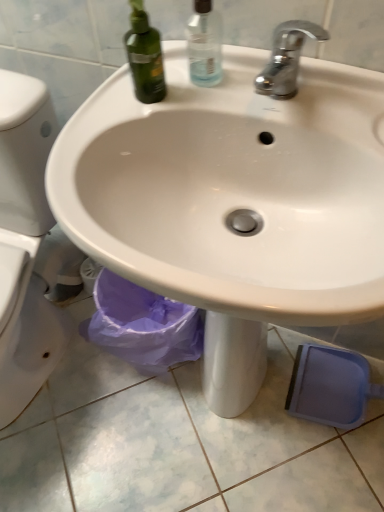
Where is `chrome metallic faucet at upper center`? chrome metallic faucet at upper center is located at coordinates (286, 58).

Describe the element at coordinates (205, 44) in the screenshot. I see `transparent plastic spray bottle at upper center` at that location.

At what (x,y) coordinates should I click in order to perform the action: click on white glossy sink at center. Please return your answer as a coordinate pair (x, y). The image size is (384, 512). Looking at the image, I should click on (x=233, y=202).

From a real-world perspective, is transparent plastic spray bottle at upper center located higher than chrome metallic faucet at upper center?

Yes, from a real-world perspective, transparent plastic spray bottle at upper center is above chrome metallic faucet at upper center.

In terms of height, does transparent plastic spray bottle at upper center look taller or shorter compared to chrome metallic faucet at upper center?

In the image, transparent plastic spray bottle at upper center appears to be taller than chrome metallic faucet at upper center.

Is transparent plastic spray bottle at upper center to the left of chrome metallic faucet at upper center from the viewer's perspective?

Indeed, transparent plastic spray bottle at upper center is positioned on the left side of chrome metallic faucet at upper center.

Is transparent plastic spray bottle at upper center spatially inside chrome metallic faucet at upper center, or outside of it?

transparent plastic spray bottle at upper center cannot be found inside chrome metallic faucet at upper center.

From a real-world perspective, between transparent plastic spray bottle at upper center and white glossy sink at center, who is vertically higher?

transparent plastic spray bottle at upper center.

Which of these two, transparent plastic spray bottle at upper center or white glossy sink at center, stands taller?

Standing taller between the two is white glossy sink at center.

Would you say transparent plastic spray bottle at upper center is inside or outside white glossy sink at center?

transparent plastic spray bottle at upper center is located beyond the bounds of white glossy sink at center.

Considering the relative sizes of transparent plastic spray bottle at upper center and white glossy sink at center in the image provided, is transparent plastic spray bottle at upper center bigger than white glossy sink at center?

Incorrect, transparent plastic spray bottle at upper center is not larger than white glossy sink at center.

Is chrome metallic faucet at upper center placed right next to transparent plastic spray bottle at upper center?

No, chrome metallic faucet at upper center is not next to transparent plastic spray bottle at upper center.

From a real-world perspective, is chrome metallic faucet at upper center under transparent plastic spray bottle at upper center?

Indeed, from a real-world perspective, chrome metallic faucet at upper center is positioned beneath transparent plastic spray bottle at upper center.

How far apart are chrome metallic faucet at upper center and transparent plastic spray bottle at upper center?

The distance of chrome metallic faucet at upper center from transparent plastic spray bottle at upper center is 4.63 inches.

Is white glossy sink at center in contact with transparent plastic spray bottle at upper center?

white glossy sink at center and transparent plastic spray bottle at upper center are not in contact.

From the picture: Is white glossy sink at center turned away from transparent plastic spray bottle at upper center?

white glossy sink at center does not have its back to transparent plastic spray bottle at upper center.

This screenshot has height=512, width=384. What are the coordinates of `sink lying in front of the transparent plastic spray bottle at upper center` in the screenshot? It's located at (233, 202).

Considering the sizes of objects white glossy sink at center and transparent plastic spray bottle at upper center in the image provided, who is smaller, white glossy sink at center or transparent plastic spray bottle at upper center?

Smaller between the two is transparent plastic spray bottle at upper center.

Does white glossy sink at center have a lesser height compared to chrome metallic faucet at upper center?

No.

Does white glossy sink at center touch chrome metallic faucet at upper center?

No, white glossy sink at center is not making contact with chrome metallic faucet at upper center.

Is white glossy sink at center outside of chrome metallic faucet at upper center?

Indeed, white glossy sink at center is completely outside chrome metallic faucet at upper center.

Does white glossy sink at center lie in front of chrome metallic faucet at upper center?

That is True.

From the picture: Which is nearer, (x=310, y=25) or (x=195, y=109)?

Clearly, point (x=310, y=25) is closer to the camera than point (x=195, y=109).

Is white glossy sink at center inside chrome metallic faucet at upper center?

No.

Which of these two, chrome metallic faucet at upper center or white glossy sink at center, is thinner?

With smaller width is chrome metallic faucet at upper center.

Find the location of a particular element. cleaning product above the chrome metallic faucet at upper center (from the image's perspective) is located at coordinates pos(205,44).

This screenshot has width=384, height=512. I want to click on cleaning product positioned vertically above the white glossy sink at center (from a real-world perspective), so click(205, 44).

Considering their positions, is transparent plastic spray bottle at upper center positioned closer to chrome metallic faucet at upper center than white glossy sink at center?

transparent plastic spray bottle at upper center is positioned closer to the anchor chrome metallic faucet at upper center.

Based on their spatial positions, is chrome metallic faucet at upper center or white glossy sink at center closer to transparent plastic spray bottle at upper center?

chrome metallic faucet at upper center is positioned closer to the anchor transparent plastic spray bottle at upper center.

Considering their positions, is white glossy sink at center positioned further to transparent plastic spray bottle at upper center than chrome metallic faucet at upper center?

Based on the image, white glossy sink at center appears to be further to transparent plastic spray bottle at upper center.

Based on the photo, from the image, which object appears to be farther from chrome metallic faucet at upper center, white glossy sink at center or transparent plastic spray bottle at upper center?

The object further to chrome metallic faucet at upper center is white glossy sink at center.

From the image, which object appears to be nearer to white glossy sink at center, transparent plastic spray bottle at upper center or chrome metallic faucet at upper center?

chrome metallic faucet at upper center is closer to white glossy sink at center.

Considering their positions, is chrome metallic faucet at upper center positioned further to white glossy sink at center than transparent plastic spray bottle at upper center?

transparent plastic spray bottle at upper center.

You are a GUI agent. You are given a task and a screenshot of the screen. Output one action in this format:
    pyautogui.click(x=<x>, y=<y>)
    Task: Click on the tap that lies between transparent plastic spray bottle at upper center and white glossy sink at center from top to bottom
    The height and width of the screenshot is (512, 384).
    Given the screenshot: What is the action you would take?
    pyautogui.click(x=286, y=58)